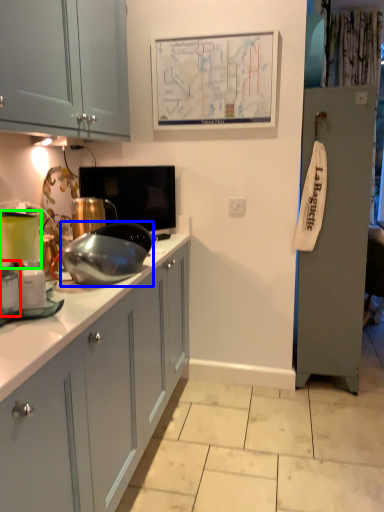
Question: Estimate the real-world distances between objects in this image. Which object is farther from kitchen appliance (highlighted by a red box), appliance (highlighted by a blue box) or home appliance (highlighted by a green box)?

Choices:
 (A) appliance
 (B) home appliance

Answer: (A)